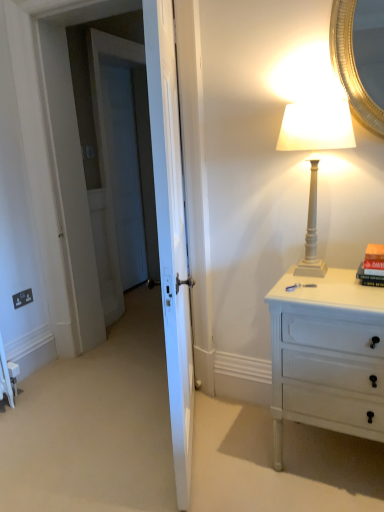
Question: Is white matte lamp at upper right positioned behind hardcover book at right?

Choices:
 (A) no
 (B) yes

Answer: (A)

Question: Considering the relative positions of white matte lamp at upper right and hardcover book at right in the image provided, is white matte lamp at upper right to the left of hardcover book at right from the viewer's perspective?

Choices:
 (A) yes
 (B) no

Answer: (A)

Question: Considering the relative sizes of white matte lamp at upper right and hardcover book at right in the image provided, is white matte lamp at upper right smaller than hardcover book at right?

Choices:
 (A) yes
 (B) no

Answer: (B)

Question: Can you confirm if white matte lamp at upper right is taller than hardcover book at right?

Choices:
 (A) yes
 (B) no

Answer: (A)

Question: Is white matte lamp at upper right outside hardcover book at right?

Choices:
 (A) no
 (B) yes

Answer: (B)

Question: In the image, is white matte lamp at upper right on the left side or the right side of black plastic electric outlet at lower left?

Choices:
 (A) left
 (B) right

Answer: (B)

Question: From the image's perspective, is white matte lamp at upper right above or below black plastic electric outlet at lower left?

Choices:
 (A) above
 (B) below

Answer: (A)

Question: Relative to black plastic electric outlet at lower left, is white matte lamp at upper right in front or behind?

Choices:
 (A) front
 (B) behind

Answer: (A)

Question: In terms of size, does white matte lamp at upper right appear bigger or smaller than black plastic electric outlet at lower left?

Choices:
 (A) big
 (B) small

Answer: (A)

Question: From the image's perspective, is white matte lamp at upper right located above or below white painted wood chest of drawers at right?

Choices:
 (A) below
 (B) above

Answer: (B)

Question: Does point (314, 261) appear closer or farther from the camera than point (382, 418)?

Choices:
 (A) farther
 (B) closer

Answer: (A)

Question: Is white matte lamp at upper right wider or thinner than white painted wood chest of drawers at right?

Choices:
 (A) thin
 (B) wide

Answer: (A)

Question: Is white matte lamp at upper right bigger or smaller than white painted wood chest of drawers at right?

Choices:
 (A) big
 (B) small

Answer: (B)

Question: Is point (340, 425) positioned closer to the camera than point (314, 185)?

Choices:
 (A) closer
 (B) farther

Answer: (B)

Question: In terms of size, does white painted wood chest of drawers at right appear bigger or smaller than white matte lamp at upper right?

Choices:
 (A) big
 (B) small

Answer: (A)